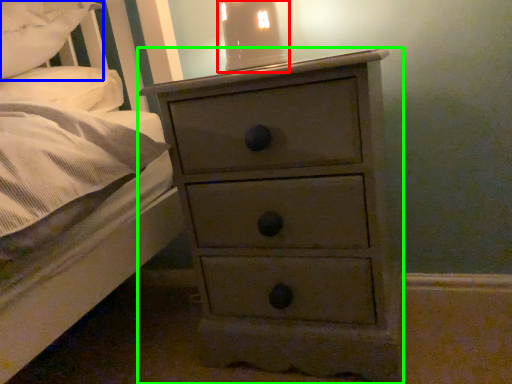
Question: Which object is positioned closest to bedside lamp (highlighted by a red box)? Select from pillow (highlighted by a blue box) and chest of drawers (highlighted by a green box).

Choices:
 (A) pillow
 (B) chest of drawers

Answer: (B)